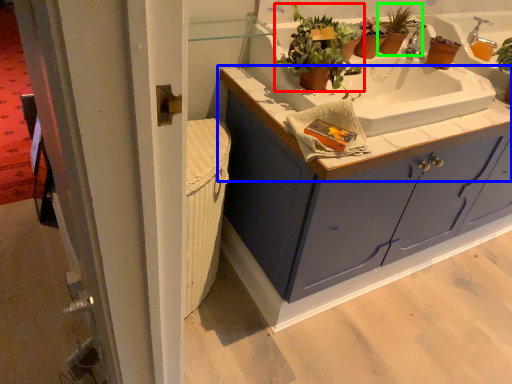
Question: Which object is positioned closest to houseplant (highlighted by a red box)? Select from countertop (highlighted by a blue box) and houseplant (highlighted by a green box).

Choices:
 (A) countertop
 (B) houseplant

Answer: (A)